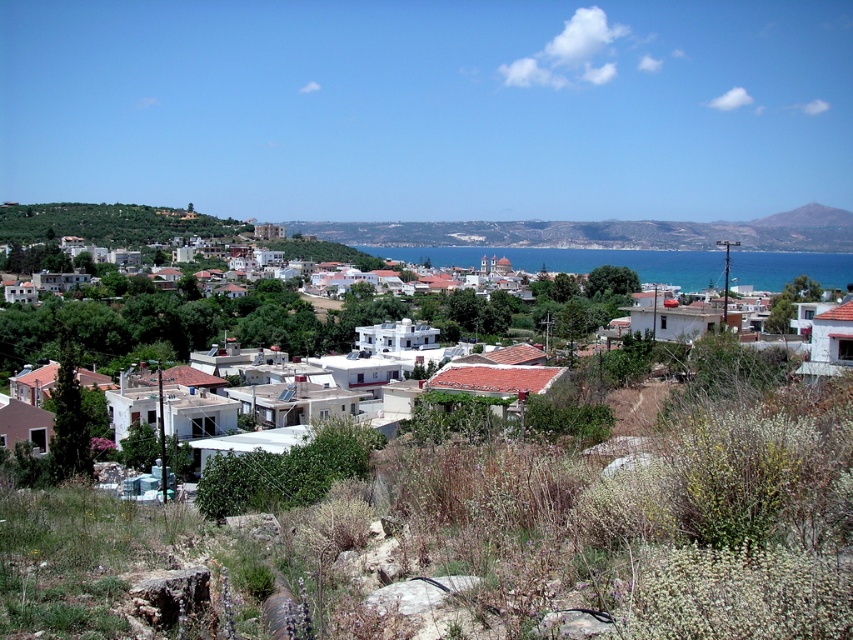
Question: Which of the following is the farthest from the observer?

Choices:
 (A) white matte houses at center
 (B) blue water at center

Answer: (B)

Question: Does white matte houses at center lie in front of blue water at center?

Choices:
 (A) yes
 (B) no

Answer: (A)

Question: Observing the image, what is the correct spatial positioning of white matte houses at center in reference to blue water at center?

Choices:
 (A) left
 (B) right

Answer: (A)

Question: Which point is closer to the camera?

Choices:
 (A) (427, 257)
 (B) (167, 323)

Answer: (B)

Question: Which of the following is the closest to the observer?

Choices:
 (A) white matte houses at center
 (B) blue water at center

Answer: (A)

Question: Does white matte houses at center have a lesser width compared to blue water at center?

Choices:
 (A) yes
 (B) no

Answer: (B)